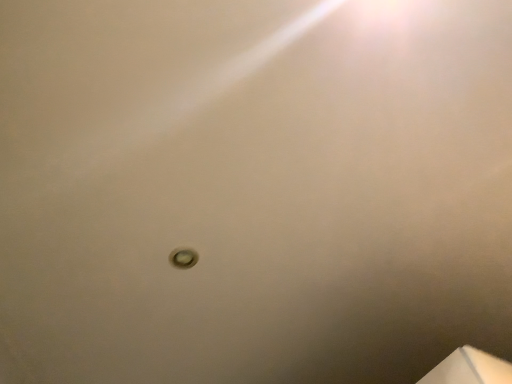
What is the approximate height of matte silver droplight at center?

The height of matte silver droplight at center is 0.75 inches.

Image resolution: width=512 pixels, height=384 pixels. Find the location of `matte silver droplight at center`. matte silver droplight at center is located at coordinates (183, 258).

What do you see at coordinates (183, 258) in the screenshot? The width and height of the screenshot is (512, 384). I see `matte silver droplight at center` at bounding box center [183, 258].

What is the approximate width of matte silver droplight at center?

3.20 inches.

The image size is (512, 384). Find the location of `matte silver droplight at center`. matte silver droplight at center is located at coordinates (183, 258).